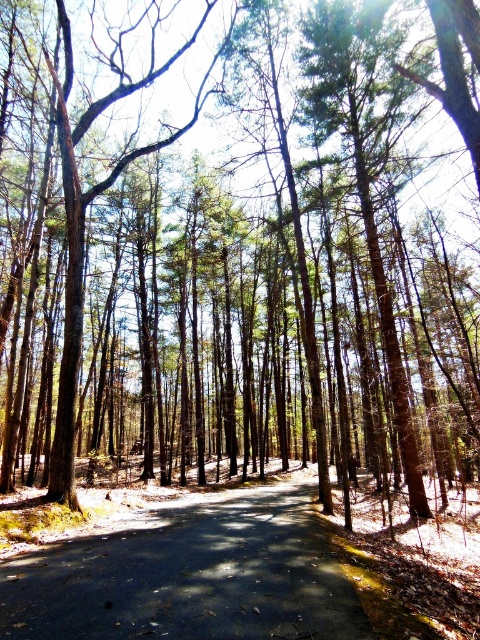
Is dark asphalt road at center bigger than brown textured tree at center?

No.

Does point (235, 628) come in front of point (62, 401)?

Yes, point (235, 628) is in front of point (62, 401).

At what (x,y) coordinates should I click in order to perform the action: click on dark asphalt road at center. Please return your answer as a coordinate pair (x, y). The width and height of the screenshot is (480, 640). Looking at the image, I should click on (190, 576).